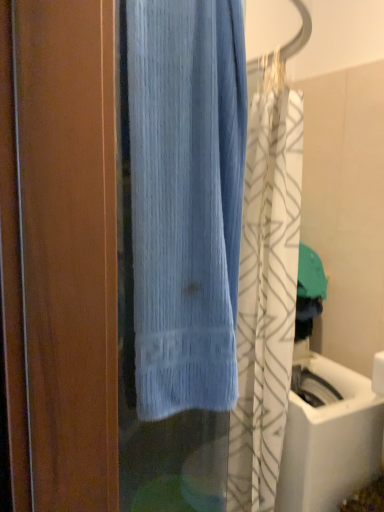
Question: From the image's perspective, is white glossy sink at lower right above or below light blue fabric at center?

Choices:
 (A) above
 (B) below

Answer: (B)

Question: Choose the correct answer: Is white glossy sink at lower right inside light blue fabric at center or outside it?

Choices:
 (A) outside
 (B) inside

Answer: (A)

Question: Which of these objects is positioned closest to the light blue fabric at center?

Choices:
 (A) white glossy sink at lower right
 (B) light blue textured towel at center

Answer: (B)

Question: Which is farther from the white glossy sink at lower right?

Choices:
 (A) light blue textured towel at center
 (B) light blue fabric at center

Answer: (B)